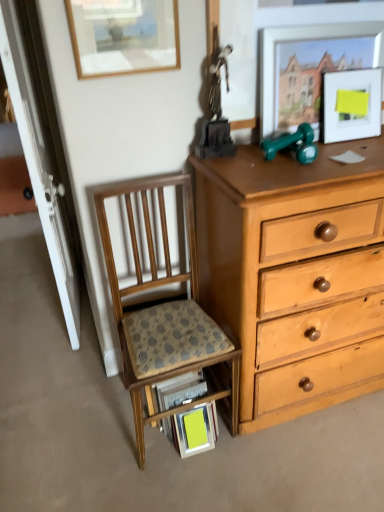
Question: Considering the relative sizes of matte silver picture frame at upper right, which ranks as the 2th picture frame in left-to-right order, and wooden chair with patterned cushion at lower left in the image provided, is matte silver picture frame at upper right, which ranks as the 2th picture frame in left-to-right order, smaller than wooden chair with patterned cushion at lower left?

Choices:
 (A) no
 (B) yes

Answer: (B)

Question: From the image's perspective, is matte silver picture frame at upper right, the second picture frame in the right-to-left sequence, located above wooden chair with patterned cushion at lower left?

Choices:
 (A) yes
 (B) no

Answer: (A)

Question: Can you confirm if matte silver picture frame at upper right, which ranks as the 2th picture frame in left-to-right order, is positioned to the right of wooden chair with patterned cushion at lower left?

Choices:
 (A) yes
 (B) no

Answer: (A)

Question: From a real-world perspective, is matte silver picture frame at upper right, the second picture frame in the right-to-left sequence, located higher than wooden chair with patterned cushion at lower left?

Choices:
 (A) no
 (B) yes

Answer: (B)

Question: Can you confirm if matte silver picture frame at upper right, the second picture frame in the right-to-left sequence, is wider than wooden chair with patterned cushion at lower left?

Choices:
 (A) no
 (B) yes

Answer: (A)

Question: Is matte silver picture frame at upper right, which ranks as the 2th picture frame in left-to-right order, positioned before wooden chair with patterned cushion at lower left?

Choices:
 (A) yes
 (B) no

Answer: (B)

Question: Is green rubber dumbbells at upper right positioned behind wooden chair with patterned cushion at lower left?

Choices:
 (A) no
 (B) yes

Answer: (B)

Question: Is green rubber dumbbells at upper right to the left of wooden chair with patterned cushion at lower left from the viewer's perspective?

Choices:
 (A) yes
 (B) no

Answer: (B)

Question: Is green rubber dumbbells at upper right in front of wooden chair with patterned cushion at lower left?

Choices:
 (A) no
 (B) yes

Answer: (A)

Question: From a real-world perspective, is green rubber dumbbells at upper right located higher than wooden chair with patterned cushion at lower left?

Choices:
 (A) yes
 (B) no

Answer: (A)

Question: Is green rubber dumbbells at upper right turned away from wooden chair with patterned cushion at lower left?

Choices:
 (A) no
 (B) yes

Answer: (A)

Question: From a real-world perspective, is green rubber dumbbells at upper right below wooden chair with patterned cushion at lower left?

Choices:
 (A) no
 (B) yes

Answer: (A)

Question: Considering the relative sizes of wooden desk at lower center and matte white picture frame at upper right, which ranks as the 3th picture frame in left-to-right order, in the image provided, is wooden desk at lower center shorter than matte white picture frame at upper right, which ranks as the 3th picture frame in left-to-right order,?

Choices:
 (A) no
 (B) yes

Answer: (A)